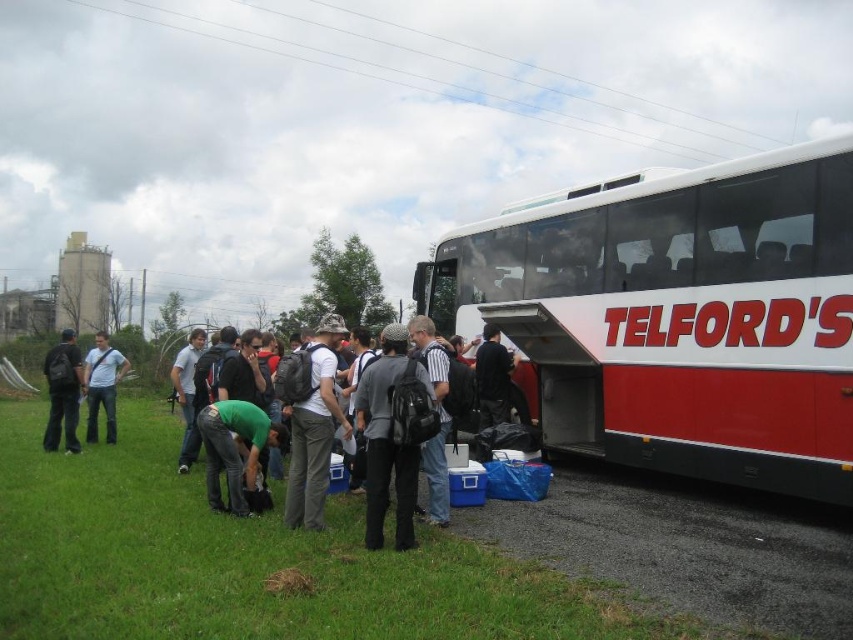
How much distance is there between red matte bus at right and dark gray fabric backpack at center?

A distance of 3.84 meters exists between red matte bus at right and dark gray fabric backpack at center.

Which is in front, point (709, 420) or point (357, 392)?

Point (357, 392) is more forward.

Image resolution: width=853 pixels, height=640 pixels. I want to click on red matte bus at right, so click(677, 316).

Does dark gray fabric backpack at center have a greater width compared to matte black backpack at left?

Incorrect, dark gray fabric backpack at center's width does not surpass matte black backpack at left's.

Is point (379, 476) positioned before point (79, 392)?

That is True.

Is point (369, 387) less distant than point (67, 358)?

Yes.

Find the location of a particular element. Image resolution: width=853 pixels, height=640 pixels. dark gray fabric backpack at center is located at coordinates (392, 435).

Does red matte bus at right appear under green fabric shirt at center?

No.

Who is higher up, red matte bus at right or green fabric shirt at center?

red matte bus at right is above.

Describe the element at coordinates (677, 316) in the screenshot. I see `red matte bus at right` at that location.

I want to click on red matte bus at right, so click(677, 316).